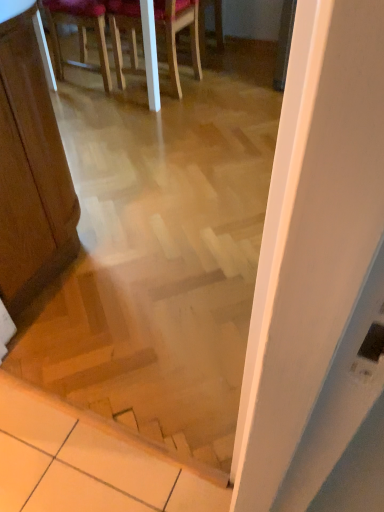
Question: Are wooden stairs at center and wooden chair at upper center, the 2th chair from the left, located far from each other?

Choices:
 (A) yes
 (B) no

Answer: (A)

Question: From a real-world perspective, is wooden stairs at center physically above wooden chair at upper center, the first chair when ordered from right to left?

Choices:
 (A) yes
 (B) no

Answer: (A)

Question: Is wooden stairs at center outside of wooden chair at upper center, the first chair when ordered from right to left?

Choices:
 (A) yes
 (B) no

Answer: (A)

Question: Is wooden stairs at center wider than wooden chair at upper center, the 2th chair from the left?

Choices:
 (A) no
 (B) yes

Answer: (A)

Question: Can you confirm if wooden stairs at center is thinner than wooden chair at upper center, the first chair when ordered from right to left?

Choices:
 (A) no
 (B) yes

Answer: (B)

Question: Considering the positions of wooden chair at upper center, the first chair when ordered from right to left, and wooden stairs at center in the image, is wooden chair at upper center, the first chair when ordered from right to left, taller or shorter than wooden stairs at center?

Choices:
 (A) tall
 (B) short

Answer: (B)

Question: From a real-world perspective, is wooden chair at upper center, the 2th chair from the left, positioned above or below wooden stairs at center?

Choices:
 (A) below
 (B) above

Answer: (A)

Question: Would you say wooden chair at upper center, the 2th chair from the left, is inside or outside wooden stairs at center?

Choices:
 (A) outside
 (B) inside

Answer: (A)

Question: Based on their sizes in the image, would you say wooden chair at upper center, the 2th chair from the left, is bigger or smaller than wooden stairs at center?

Choices:
 (A) small
 (B) big

Answer: (B)

Question: From the image's perspective, is wooden chair at upper center, marked as the 2th chair in a right-to-left arrangement, located above or below wooden stairs at center?

Choices:
 (A) below
 (B) above

Answer: (B)

Question: Considering the positions of wooden chair at upper center, which is the 1th chair in left-to-right order, and wooden stairs at center in the image, is wooden chair at upper center, which is the 1th chair in left-to-right order, taller or shorter than wooden stairs at center?

Choices:
 (A) tall
 (B) short

Answer: (B)

Question: In the image, is wooden chair at upper center, which is the 1th chair in left-to-right order, on the left side or the right side of wooden stairs at center?

Choices:
 (A) right
 (B) left

Answer: (B)

Question: Considering their positions, is wooden chair at upper center, marked as the 2th chair in a right-to-left arrangement, located in front of or behind wooden stairs at center?

Choices:
 (A) behind
 (B) front

Answer: (A)

Question: In the image, is wooden stairs at center positioned in front of or behind wooden chair at upper center, the first chair when ordered from right to left?

Choices:
 (A) front
 (B) behind

Answer: (A)

Question: Is wooden stairs at center spatially inside wooden chair at upper center, the 2th chair from the left, or outside of it?

Choices:
 (A) outside
 (B) inside

Answer: (A)